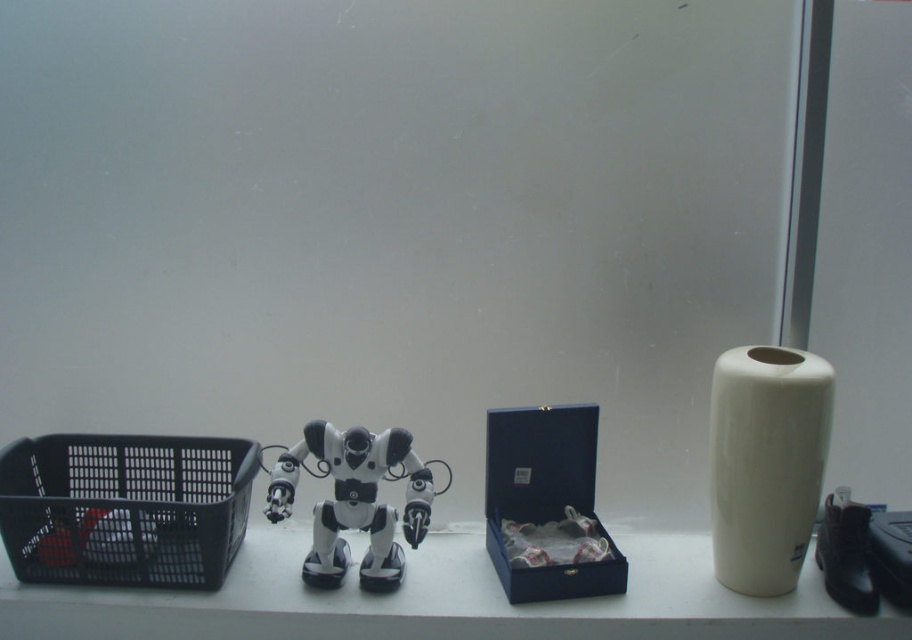
You are a delivery drone that needs to place a package on the white glossy vase at right. The drone has a maximum delivery range of 1.5 meters. Can it successfully deliver the package to the vase?

The distance between the white glossy vase at right and the camera is 1.39 meters, which is within the drone delivery range of 1.5 meters. Therefore, the drone can successfully deliver the package to the vase.